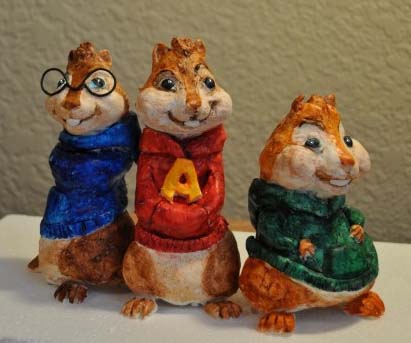
Locate an element on the screen. table is located at coordinates (55, 314).